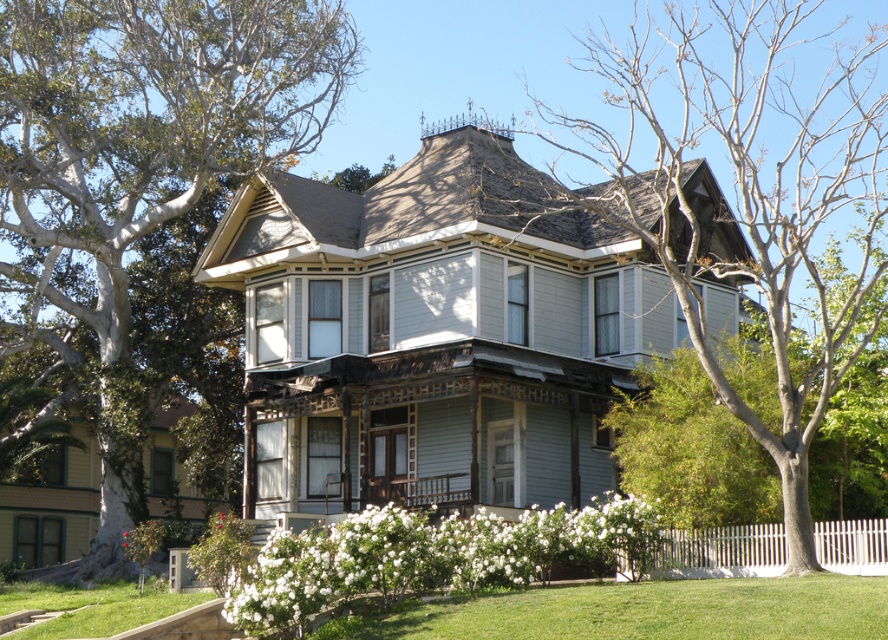
You are standing in front of the Victorian house and want to take a photo of the white picket fence at lower right. However, the bare branches at upper center are blocking the view. Can you determine if the branches are taller than the fence?

The bare branches at upper center is taller than white picket fence at lower right, so yes, the branches are blocking the view because they are taller than the fence.